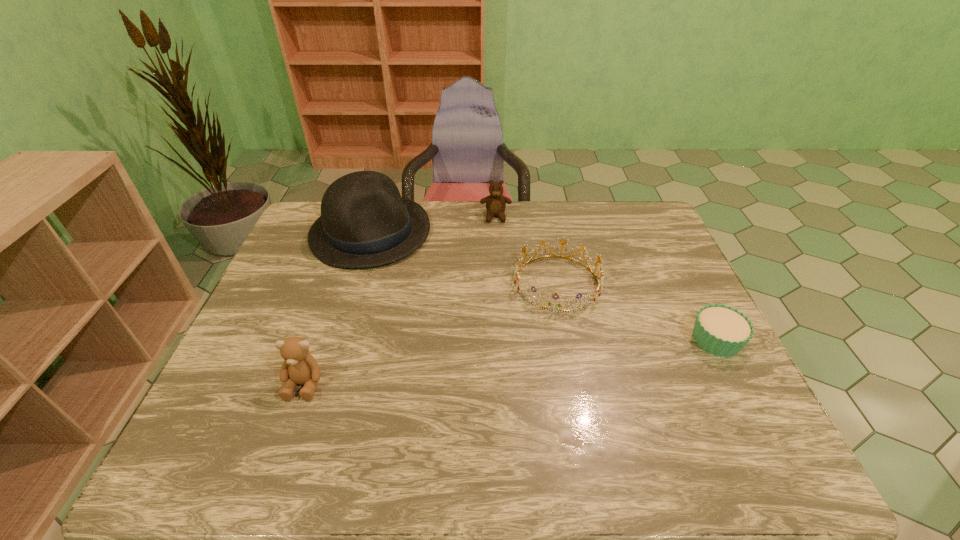
Locate an element on the screen. This screenshot has width=960, height=540. vacant region located at the face of the right teddy bear is located at coordinates (496, 238).

Locate an element on the screen. free spot located 0.250m at the face of the right teddy bear is located at coordinates (497, 272).

Locate an element on the screen. free spot located on the front-facing side of the bowler hat is located at coordinates (450, 334).

Locate an element on the screen. free space located 0.220m on the front-facing side of the bowler hat is located at coordinates (430, 308).

What are the coordinates of `blank area located on the front-facing side of the bowler hat` in the screenshot? It's located at (430, 308).

This screenshot has height=540, width=960. Find the location of `vacant position located 0.190m on the front-facing side of the second shortest object`. vacant position located 0.190m on the front-facing side of the second shortest object is located at coordinates (545, 373).

At what (x,y) coordinates should I click in order to perform the action: click on free space located 0.220m on the front-facing side of the second shortest object. Please return your answer as a coordinate pair (x, y). The height and width of the screenshot is (540, 960). Looking at the image, I should click on (544, 383).

Locate an element on the screen. vacant space situated on the front-facing side of the second shortest object is located at coordinates (543, 386).

In order to click on teddy bear that is at the far edge in this screenshot , I will do `click(495, 203)`.

The height and width of the screenshot is (540, 960). Find the location of `bowler hat present at the far edge`. bowler hat present at the far edge is located at coordinates (364, 222).